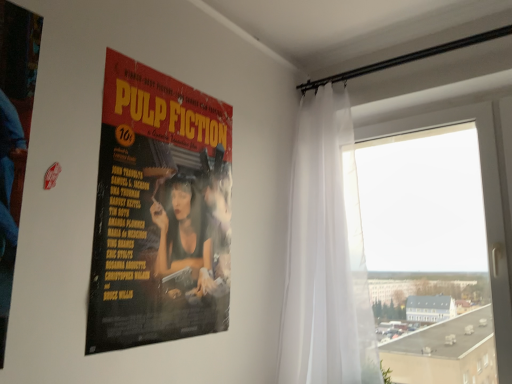
Find the location of a particular element. The width and height of the screenshot is (512, 384). matte paper poster at center is located at coordinates (159, 211).

What is the approximate height of white sheer curtain at right?

The height of white sheer curtain at right is 1.48 meters.

The width and height of the screenshot is (512, 384). In order to click on matte paper poster at center in this screenshot , I will do `click(159, 211)`.

Where is `curtain on the right of the matte paper poster at center`? curtain on the right of the matte paper poster at center is located at coordinates (326, 254).

Between white sheer curtain at right and matte paper poster at center, which one appears on the right side from the viewer's perspective?

white sheer curtain at right is more to the right.

Looking at this image, considering the sizes of white sheer curtain at right and matte paper poster at center in the image, is white sheer curtain at right taller or shorter than matte paper poster at center?

In the image, white sheer curtain at right appears to be taller than matte paper poster at center.

Between white sheer curtain at right and matte paper poster at center, which one has smaller size?

Smaller between the two is matte paper poster at center.

Is transparent glass window at right situated inside white sheer curtain at right or outside?

transparent glass window at right is not inside white sheer curtain at right, it's outside.

This screenshot has width=512, height=384. Find the location of `curtain to the left of transparent glass window at right`. curtain to the left of transparent glass window at right is located at coordinates (326, 254).

Can you confirm if transparent glass window at right is taller than white sheer curtain at right?

No, transparent glass window at right is not taller than white sheer curtain at right.

Based on the photo, which is more to the right, transparent glass window at right or white sheer curtain at right?

Positioned to the right is transparent glass window at right.

Between transparent glass window at right and matte paper poster at center, which one has larger width?

transparent glass window at right.

Does point (485, 134) come behind point (204, 303)?

That is True.

From a real-world perspective, is transparent glass window at right physically below matte paper poster at center?

Yes, from a real-world perspective, transparent glass window at right is under matte paper poster at center.

Is transparent glass window at right not within matte paper poster at center?

Yes, transparent glass window at right is outside of matte paper poster at center.

How many degrees apart are the facing directions of matte paper poster at center and white sheer curtain at right?

matte paper poster at center and white sheer curtain at right are facing 89.8 degrees away from each other.

Who is taller, matte paper poster at center or white sheer curtain at right?

Standing taller between the two is white sheer curtain at right.

Where is `poster above the white sheer curtain at right (from the image's perspective)`? The width and height of the screenshot is (512, 384). poster above the white sheer curtain at right (from the image's perspective) is located at coordinates (159, 211).

Does matte paper poster at center turn towards white sheer curtain at right?

No, matte paper poster at center is not aimed at white sheer curtain at right.

In the scene shown: Is transparent glass window at right a part of matte paper poster at center?

No, transparent glass window at right is not a part of matte paper poster at center.

Is matte paper poster at center further to the viewer compared to transparent glass window at right?

No, matte paper poster at center is closer to the viewer.

Does matte paper poster at center have a lesser width compared to transparent glass window at right?

Indeed, matte paper poster at center has a lesser width compared to transparent glass window at right.

Is white sheer curtain at right located outside transparent glass window at right?

Yes, white sheer curtain at right is outside of transparent glass window at right.

Which point is more forward, (340, 218) or (497, 154)?

Positioned in front is point (497, 154).

Is white sheer curtain at right oriented towards transparent glass window at right?

No, white sheer curtain at right is not aimed at transparent glass window at right.

Is white sheer curtain at right behind transparent glass window at right?

No, white sheer curtain at right is closer to the viewer.

The height and width of the screenshot is (384, 512). Identify the location of poster that appears above the white sheer curtain at right (from the image's perspective). (159, 211).

I want to click on curtain located on the left of transparent glass window at right, so click(326, 254).

When comparing their distances from transparent glass window at right, does white sheer curtain at right or matte paper poster at center seem closer?

white sheer curtain at right.

Which object lies further to the anchor point white sheer curtain at right, transparent glass window at right or matte paper poster at center?

matte paper poster at center.

Looking at the image, which one is located closer to matte paper poster at center, white sheer curtain at right or transparent glass window at right?

white sheer curtain at right is positioned closer to the anchor matte paper poster at center.

Estimate the real-world distances between objects in this image. Which object is further from white sheer curtain at right, matte paper poster at center or transparent glass window at right?

matte paper poster at center.

Based on their spatial positions, is matte paper poster at center or white sheer curtain at right further from transparent glass window at right?

matte paper poster at center is further to transparent glass window at right.

From the image, which object appears to be farther from matte paper poster at center, transparent glass window at right or white sheer curtain at right?

transparent glass window at right is further to matte paper poster at center.

Locate an element on the screen. Image resolution: width=512 pixels, height=384 pixels. curtain situated between matte paper poster at center and transparent glass window at right from left to right is located at coordinates [326, 254].